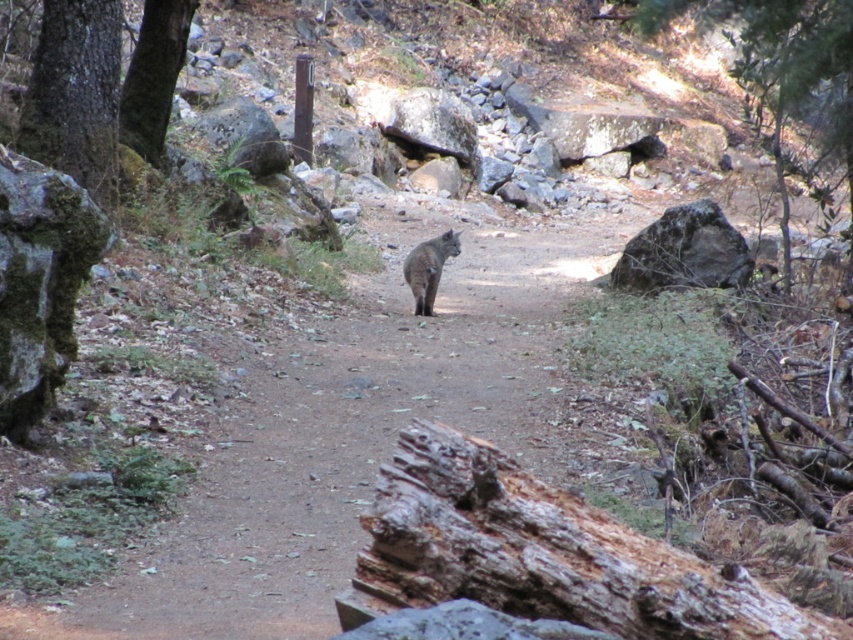
Question: Does brown dirt trail at center appear on the left side of gray rough rock at right?

Choices:
 (A) yes
 (B) no

Answer: (A)

Question: Which of the following is the farthest from the observer?

Choices:
 (A) fuzzy brown cat at center
 (B) weathered brown log at lower center
 (C) brown dirt trail at center
 (D) gray rough rock at right

Answer: (D)

Question: Among these points, which one is nearest to the camera?

Choices:
 (A) (581, 586)
 (B) (451, 253)
 (C) (660, 234)
 (D) (450, 385)

Answer: (A)

Question: Among these objects, which one is nearest to the camera?

Choices:
 (A) gray rough rock at right
 (B) brown dirt trail at center
 (C) green leafy tree at upper right

Answer: (B)

Question: Can you confirm if brown dirt trail at center is thinner than gray rough rock at right?

Choices:
 (A) no
 (B) yes

Answer: (A)

Question: Does brown dirt trail at center appear under fuzzy brown cat at center?

Choices:
 (A) yes
 (B) no

Answer: (A)